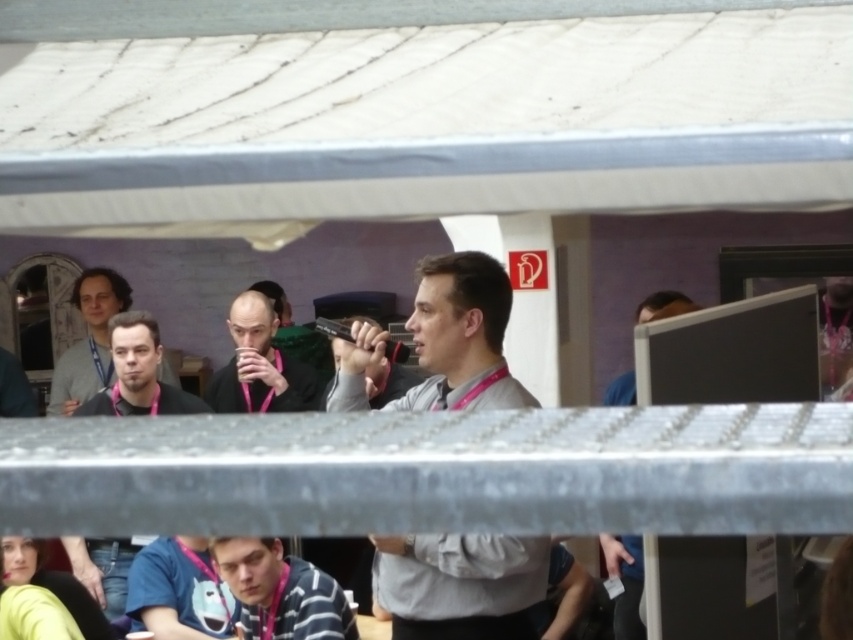
Question: Is metal at center below blue fabric shirt at right?

Choices:
 (A) yes
 (B) no

Answer: (B)

Question: Considering the relative positions of metal at center and blue matte t-shirt at lower center in the image provided, where is metal at center located with respect to blue matte t-shirt at lower center?

Choices:
 (A) above
 (B) below

Answer: (A)

Question: Which of the following is the closest to the observer?

Choices:
 (A) coord(521,600)
 (B) coord(126,586)
 (C) coord(142,321)
 (D) coord(679,307)

Answer: (A)

Question: Does blue matte t-shirt at lower center lie behind matte black mug at center?

Choices:
 (A) yes
 (B) no

Answer: (B)

Question: Among these points, which one is nearest to the camera?

Choices:
 (A) (404, 588)
 (B) (61, 500)

Answer: (B)

Question: Which object is farther from the camera taking this photo?

Choices:
 (A) blue fabric shirt at right
 (B) matte black mug at center
 (C) metal at center

Answer: (B)